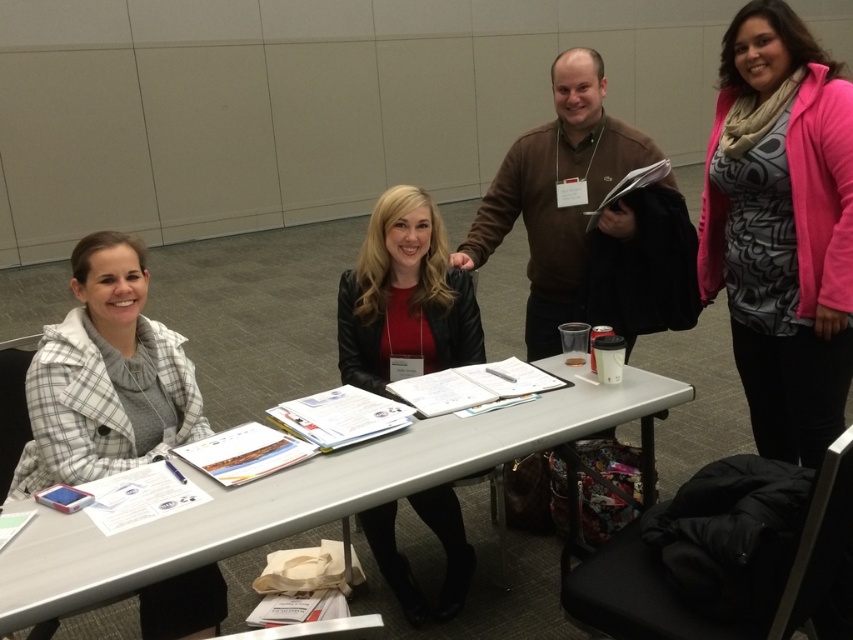
You are organizing a meeting and need to place a laptop on the table. Given that the laptop is the same size as the leather jacket at center, will it fit on the white plastic table at center?

The white plastic table at center is larger in size than the leather jacket at center, so the laptop will fit on the table.

You are standing at point (453, 307) and want to walk to point (753, 404). Which direction should you move in to reach your destination?

To reach point (753, 404) from point (453, 307), you should move towards the direction where the x and y coordinates increase, as point (753, 404) is located behind point (453, 307).